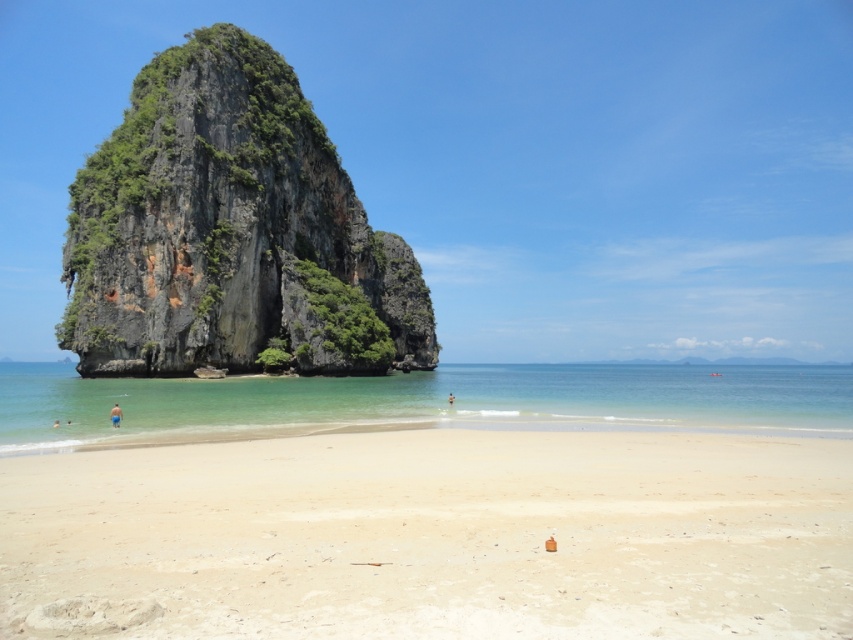
Question: Which point is closer to the camera taking this photo?

Choices:
 (A) (453, 400)
 (B) (425, 573)
 (C) (119, 417)
 (D) (653, 400)

Answer: (B)

Question: Considering the real-world distances, which object is closest to the clear blue water at center?

Choices:
 (A) blue fabric shorts at lower left
 (B) light beige sand at center
 (C) green mossy rock at center
 (D) skinny person at center

Answer: (C)

Question: Is clear blue water at center to the right of skinny person at center from the viewer's perspective?

Choices:
 (A) no
 (B) yes

Answer: (B)

Question: Does green mossy rock at center appear under blue fabric shorts at lower left?

Choices:
 (A) no
 (B) yes

Answer: (A)

Question: Which object appears farthest from the camera in this image?

Choices:
 (A) clear blue water at center
 (B) light beige sand at center
 (C) green mossy rock at center
 (D) skinny person at center

Answer: (C)

Question: Does blue fabric shorts at lower left have a smaller size compared to skinny person at center?

Choices:
 (A) yes
 (B) no

Answer: (B)